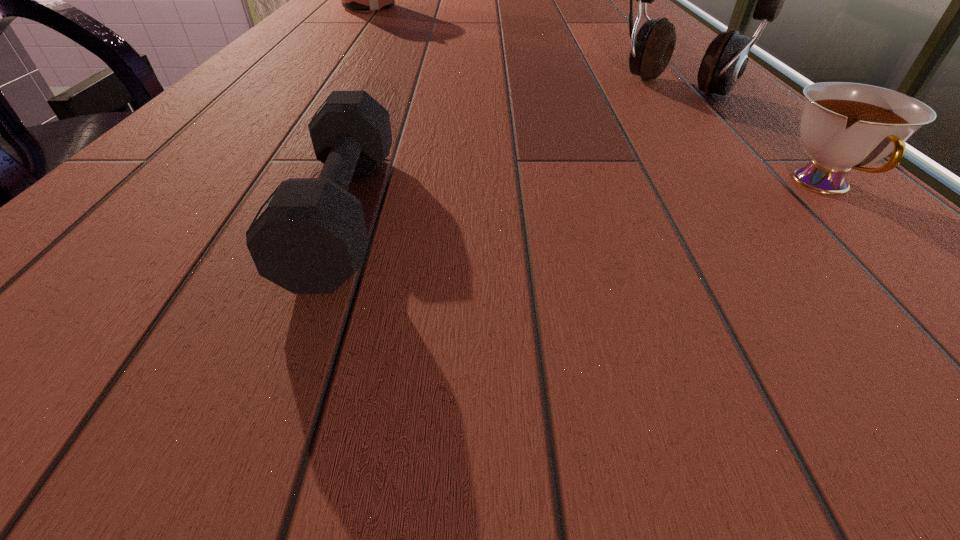
Image resolution: width=960 pixels, height=540 pixels. I want to click on free space between the teacup and the earphone, so click(751, 137).

Point out which object is positioned as the third nearest to the third object from right to left. Please provide its 2D coordinates. Your answer should be formatted as a tuple, i.e. [(x, y)], where the tuple contains the x and y coordinates of a point satisfying the conditions above.

[(363, 0)]

Identify which object is the nearest to the leftmost object. Please provide its 2D coordinates. Your answer should be formatted as a tuple, i.e. [(x, y)], where the tuple contains the x and y coordinates of a point satisfying the conditions above.

[(725, 60)]

Where is `free space that satisfies the following two spatial constraints: 1. on the front side of the dumbbell; 2. on the left side of the leftmost object`? The width and height of the screenshot is (960, 540). free space that satisfies the following two spatial constraints: 1. on the front side of the dumbbell; 2. on the left side of the leftmost object is located at coordinates (208, 212).

The width and height of the screenshot is (960, 540). What are the coordinates of `vacant region that satisfies the following two spatial constraints: 1. on the back side of the tallest object; 2. on the right side of the second object from left to right` in the screenshot? It's located at (393, 87).